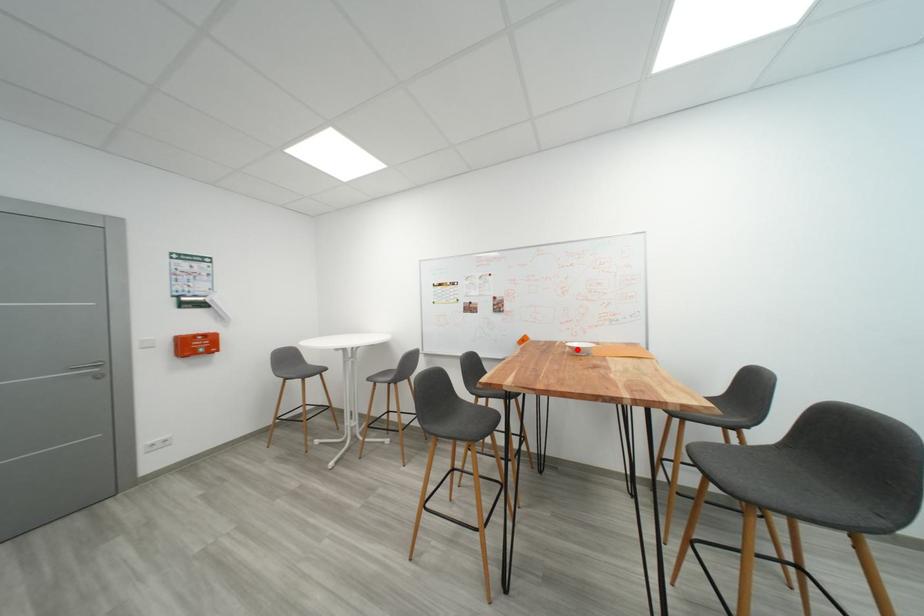
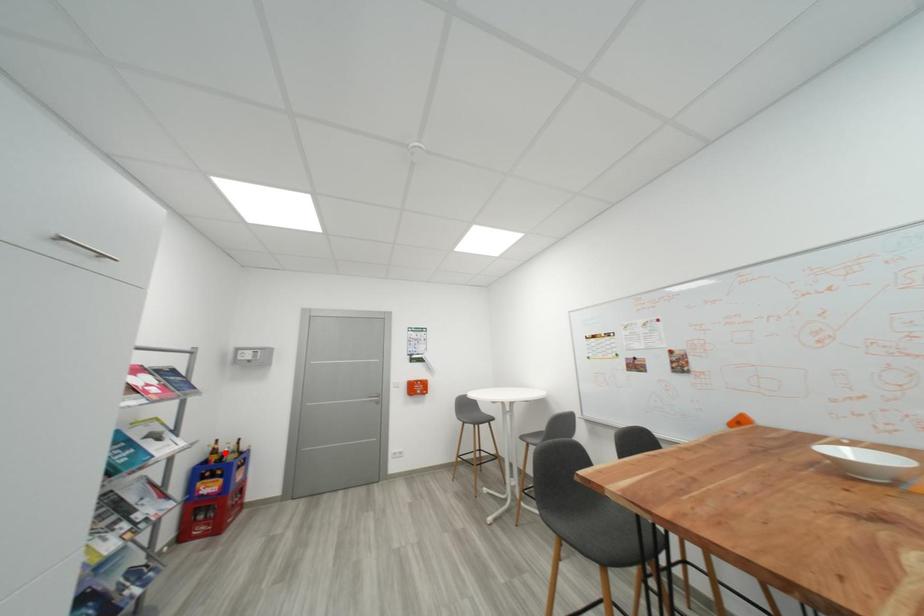
I am providing you with two images of the same scene from different viewpoints. A red point is marked on the first image and another point is marked on the second image. Are the points marked in image1 and image2 representing the same 3D position?

No